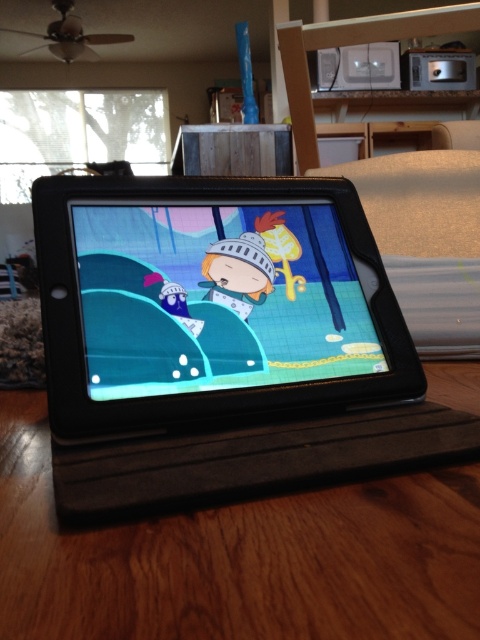
You are placing a new lamp on the wooden table at center. To ensure stability, you need to know the table dimensions. Can you determine if the table is large enough to accommodate a lamp that requires a 30 cm by 30 cm space?

The wooden table at center is located at point [238,557], but without information about its dimensions, it is impossible to determine if it can fit the lamp. Please provide more details about the table size.

You are arranging items on the wooden table at center and need to place the matte black tablet at center. Considering the space available, can the tablet fit entirely on the table without overhanging the edges?

The wooden table at center is wider than the matte black tablet at center, so yes, the tablet can fit entirely on the table without overhanging the edges.

Looking at this image, you have a small toy car that is 4 inches long. You want to place it on the wooden table at center so it can reach the matte black tablet at center. Will the toy car be able to reach the tablet from the edge of the table?

The wooden table at center and matte black tablet at center are 4.88 inches apart. Since the toy car is 4 inches long, it can only reach 4 inches from the edge of the table, which is shorter than the 4.88 inches needed. Therefore, the toy car cannot reach the matte black tablet at center from the edge of the wooden table at center.